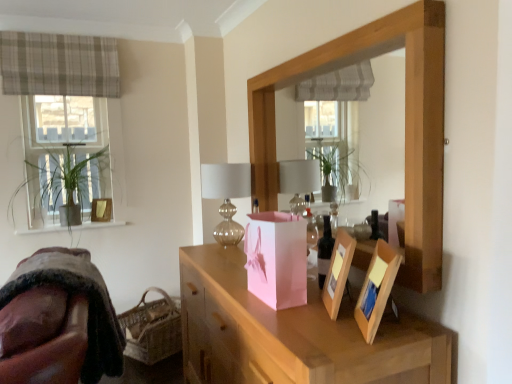
Question: Is the position of translucent glass table lamp at center more distant than that of pink paper bag at center?

Choices:
 (A) no
 (B) yes

Answer: (B)

Question: Is translucent glass table lamp at center facing towards pink paper bag at center?

Choices:
 (A) no
 (B) yes

Answer: (A)

Question: Is translucent glass table lamp at center bigger than pink paper bag at center?

Choices:
 (A) no
 (B) yes

Answer: (A)

Question: Considering the relative positions of translucent glass table lamp at center and pink paper bag at center in the image provided, is translucent glass table lamp at center to the right of pink paper bag at center from the viewer's perspective?

Choices:
 (A) yes
 (B) no

Answer: (B)

Question: Does translucent glass table lamp at center have a lesser width compared to pink paper bag at center?

Choices:
 (A) no
 (B) yes

Answer: (B)

Question: Is dark brown glass bottle at center in front of or behind brown suede swivel chair at lower left in the image?

Choices:
 (A) behind
 (B) front

Answer: (A)

Question: Looking at their shapes, would you say dark brown glass bottle at center is wider or thinner than brown suede swivel chair at lower left?

Choices:
 (A) wide
 (B) thin

Answer: (B)

Question: Is dark brown glass bottle at center spatially inside brown suede swivel chair at lower left, or outside of it?

Choices:
 (A) inside
 (B) outside

Answer: (B)

Question: From the image's perspective, is dark brown glass bottle at center located above or below brown suede swivel chair at lower left?

Choices:
 (A) below
 (B) above

Answer: (B)

Question: Is point (321, 254) closer or farther from the camera than point (250, 160)?

Choices:
 (A) farther
 (B) closer

Answer: (B)

Question: Would you say dark brown glass bottle at center is inside or outside wooden mirror at upper center?

Choices:
 (A) inside
 (B) outside

Answer: (B)

Question: Looking at the image, does dark brown glass bottle at center seem bigger or smaller compared to wooden mirror at upper center?

Choices:
 (A) big
 (B) small

Answer: (B)

Question: From a real-world perspective, relative to wooden mirror at upper center, is dark brown glass bottle at center vertically above or below?

Choices:
 (A) below
 (B) above

Answer: (A)

Question: Choose the correct answer: Is pink paper bag at center inside pink paper bag at center or outside it?

Choices:
 (A) inside
 (B) outside

Answer: (B)

Question: In the image, is pink paper bag at center positioned in front of or behind pink paper bag at center?

Choices:
 (A) behind
 (B) front

Answer: (B)